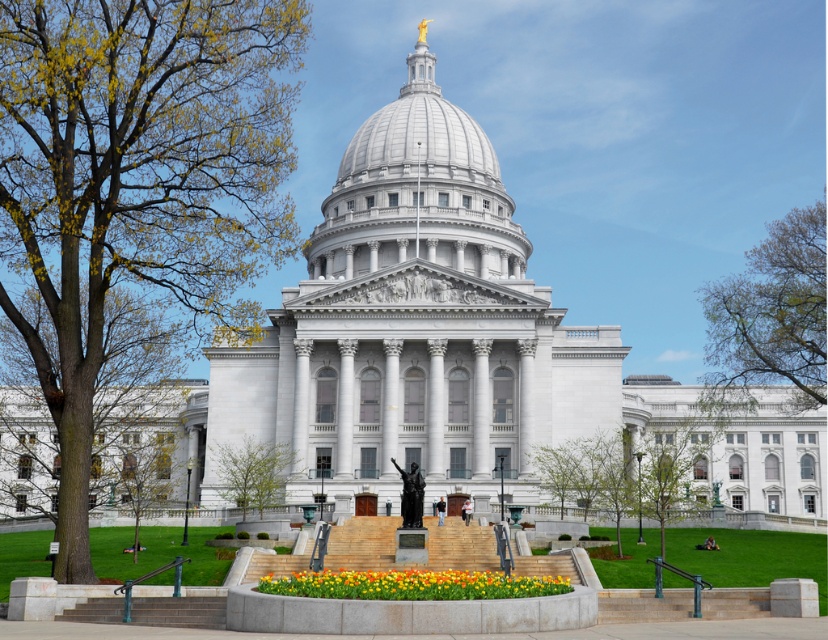
You are a photographer planning to take a picture of the Wisconsin State Capitol building. You want to include both the green leafy tree at lower left and the concrete steps at center in your frame. Which object should you position closer to the edge of the frame to ensure both are visible?

The concrete steps at center should be positioned closer to the edge of the frame because the green leafy tree at lower left is larger in size, so placing the smaller concrete steps at center near the edge allows both to fit within the frame.

You are a visitor standing at the base of the Wisconsin State Capitol building. You notice a green leafy tree at left and a brown leafy tree at upper right. Which tree is taller?

The green leafy tree at left is much taller than the brown leafy tree at upper right.

You are standing at the base of the Wisconsin State Capitol building looking towards the entrance. There is a point marked at coordinates (135, 192). What object is located at this point?

The point at coordinates (135, 192) marks a green leafy tree at the left side of the scene.